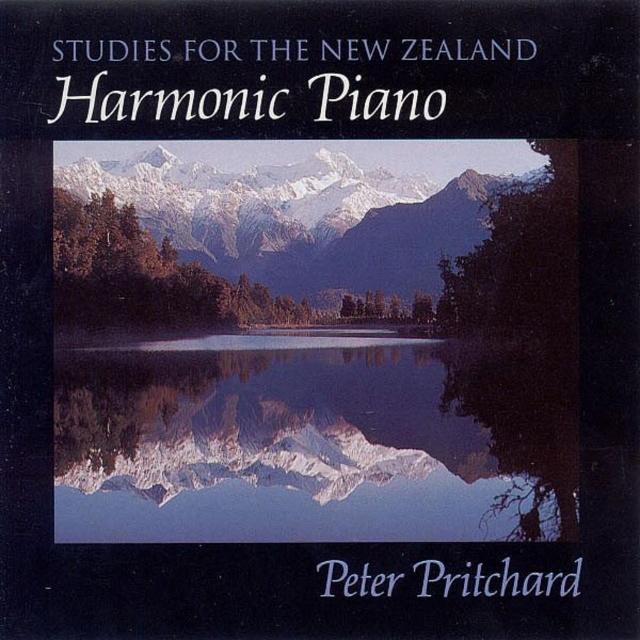
Question: Can you confirm if transparent glass water at center is positioned to the right of snowy gray mountain range at center?

Choices:
 (A) yes
 (B) no

Answer: (A)

Question: Is transparent glass water at center thinner than snowy gray mountain range at center?

Choices:
 (A) no
 (B) yes

Answer: (A)

Question: Among these points, which one is farthest from the camera?

Choices:
 (A) (368, 266)
 (B) (97, 371)

Answer: (A)

Question: Does transparent glass water at center have a greater width compared to snowy gray mountain range at center?

Choices:
 (A) no
 (B) yes

Answer: (B)